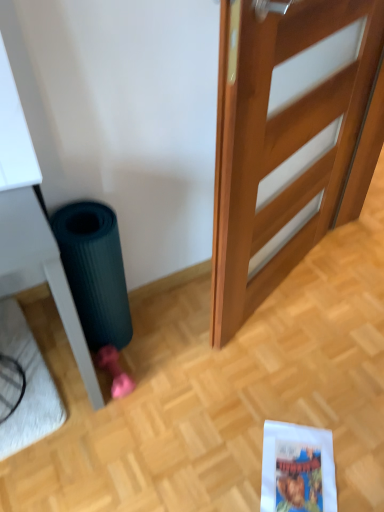
Find the location of `vacant area that lies to the right of dark green rubber mat at lower left`. vacant area that lies to the right of dark green rubber mat at lower left is located at coordinates (164, 333).